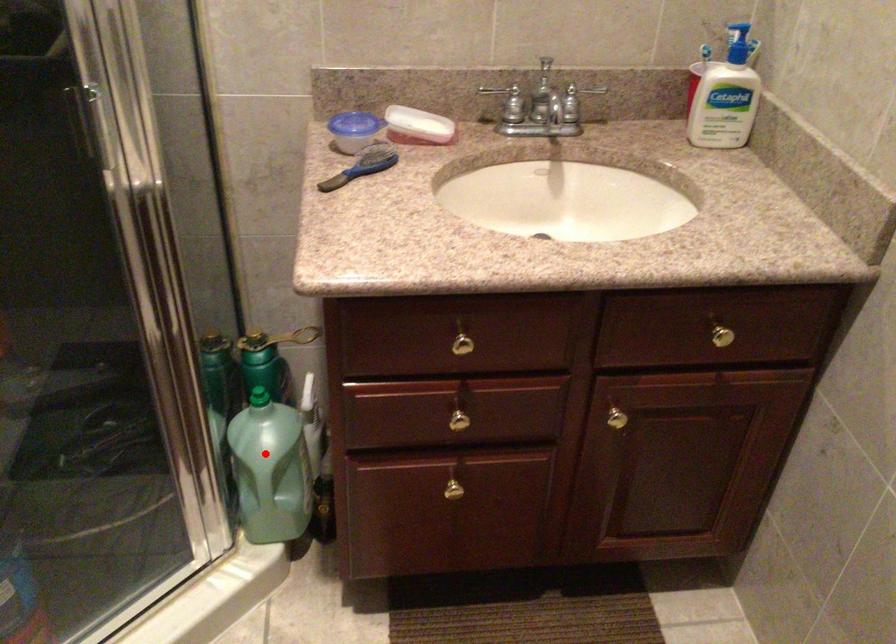
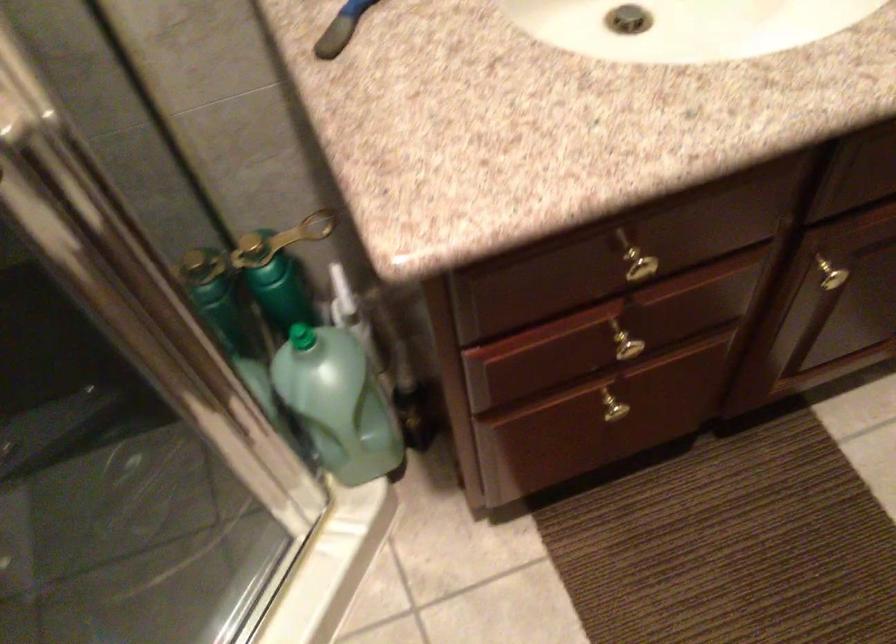
The point at the highlighted location is marked in the first image. Where is the corresponding point in the second image?

(338, 402)